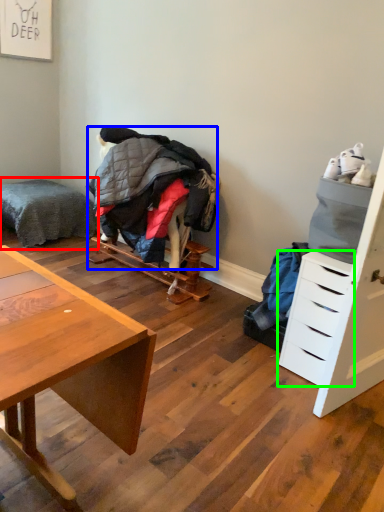
Question: Considering the real-world distances, which object is closest to bed (highlighted by a red box)? clothing (highlighted by a blue box) or drawer (highlighted by a green box).

Choices:
 (A) clothing
 (B) drawer

Answer: (A)